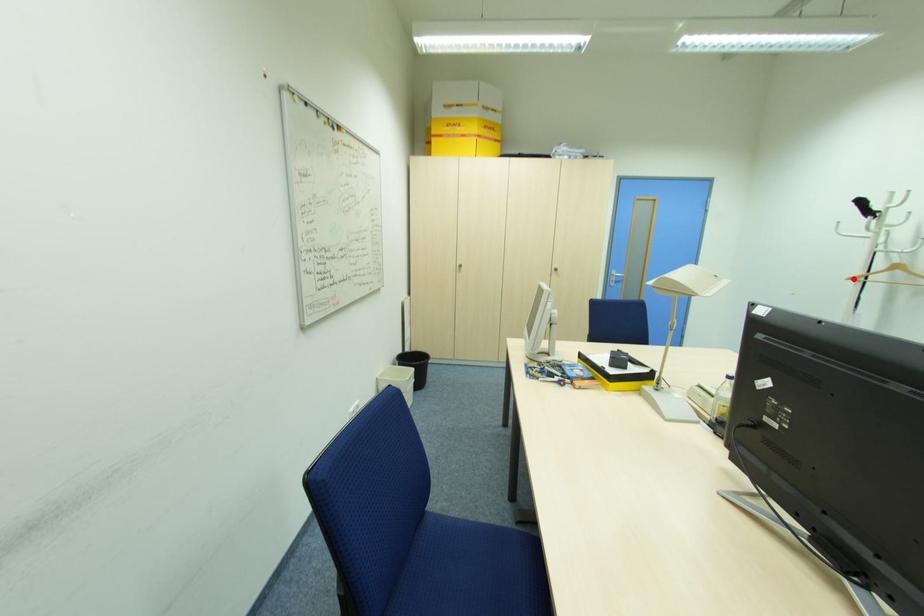
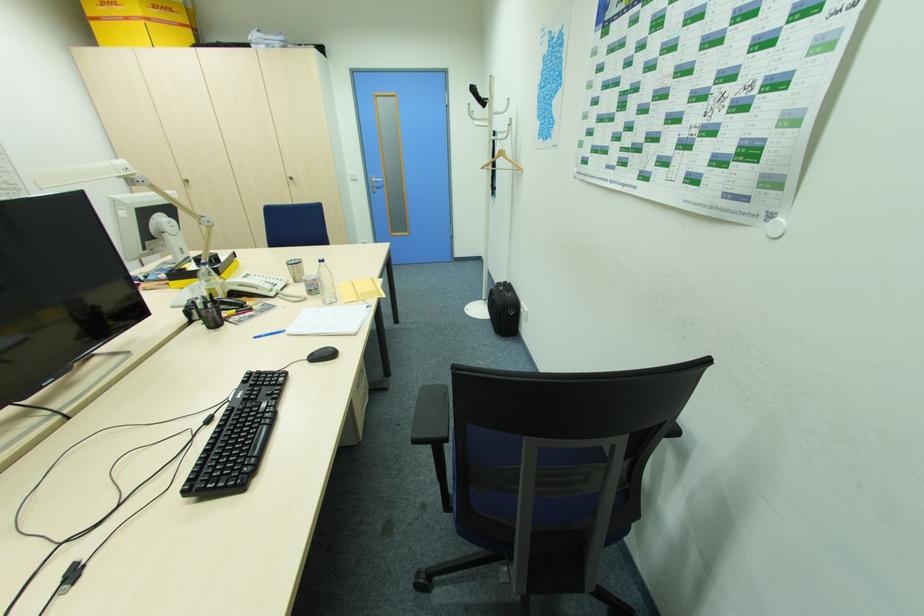
Find the pixel in the second image that matches the highlighted location in the first image.

(485, 168)